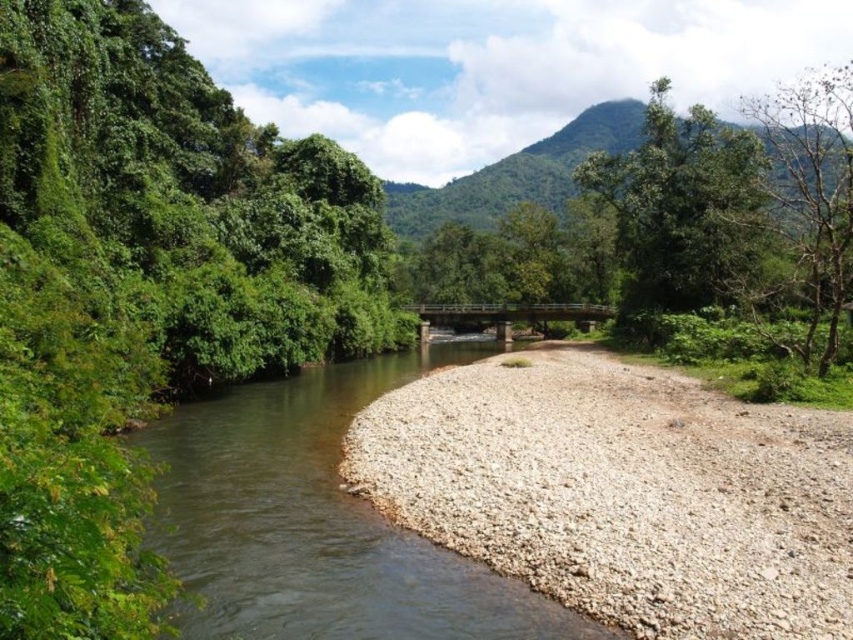
Is brown gravel river at center bigger than green leafy tree at upper right?

Actually, brown gravel river at center might be smaller than green leafy tree at upper right.

Measure the distance between point (300, 387) and camera.

Point (300, 387) is 423.00 feet away from camera.

Is point (469, 604) behind point (648, 120)?

No.

The width and height of the screenshot is (853, 640). I want to click on brown gravel river at center, so click(315, 522).

Describe the element at coordinates (144, 289) in the screenshot. The width and height of the screenshot is (853, 640). I see `green leafy tree at left` at that location.

Who is shorter, green leafy tree at left or brown gravel river at center?

Standing shorter between the two is brown gravel river at center.

Describe the element at coordinates (144, 289) in the screenshot. I see `green leafy tree at left` at that location.

Find the location of a particular element. The image size is (853, 640). green leafy tree at left is located at coordinates (144, 289).

Does green leafy tree at left have a lesser width compared to green leafy mountain at upper center?

Yes.

Based on the photo, can you confirm if green leafy tree at left is positioned above green leafy mountain at upper center?

No, green leafy tree at left is not above green leafy mountain at upper center.

Find the location of a particular element. This screenshot has width=853, height=640. green leafy tree at left is located at coordinates (144, 289).